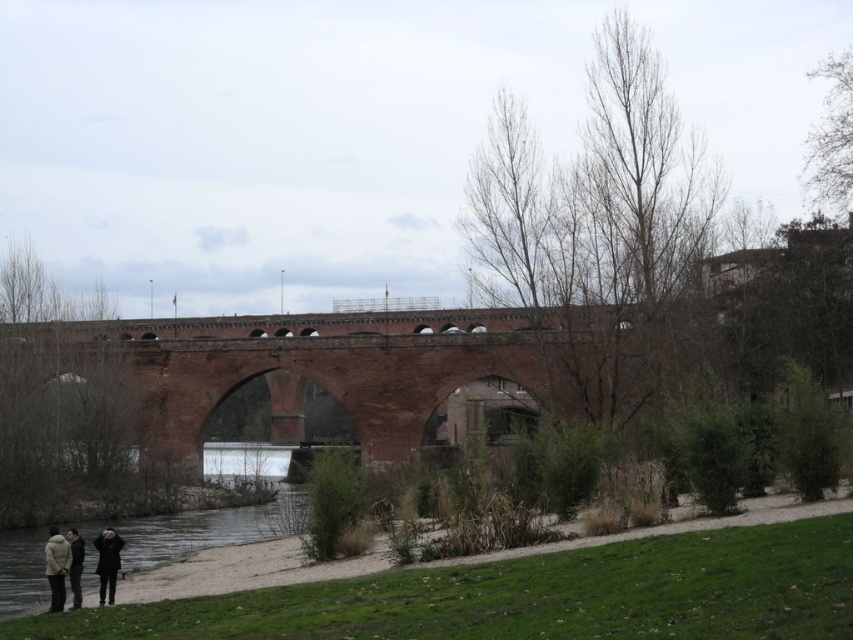
Is the position of dark gray coat at lower left less distant than that of dark gray sweater at lower left?

No.

Who is taller, dark gray coat at lower left or dark gray sweater at lower left?

dark gray coat at lower left

You are a GUI agent. You are given a task and a screenshot of the screen. Output one action in this format:
    pyautogui.click(x=<x>, y=<y>)
    Task: Click on the dark gray coat at lower left
    The image size is (853, 640).
    Given the screenshot: What is the action you would take?
    pyautogui.click(x=107, y=563)

This screenshot has height=640, width=853. I want to click on dark gray coat at lower left, so click(x=107, y=563).

Does beige wool coat at lower left appear on the left side of dark gray sweater at lower left?

Yes, beige wool coat at lower left is to the left of dark gray sweater at lower left.

Between point (65, 552) and point (80, 538), which one is positioned in front?

Positioned in front is point (65, 552).

This screenshot has width=853, height=640. Identify the location of beige wool coat at lower left. (56, 566).

Is red brick bridge at center thinner than dark gray coat at lower left?

No.

The width and height of the screenshot is (853, 640). Find the location of `red brick bridge at center`. red brick bridge at center is located at coordinates (364, 365).

Locate an element on the screen. This screenshot has height=640, width=853. red brick bridge at center is located at coordinates (364, 365).